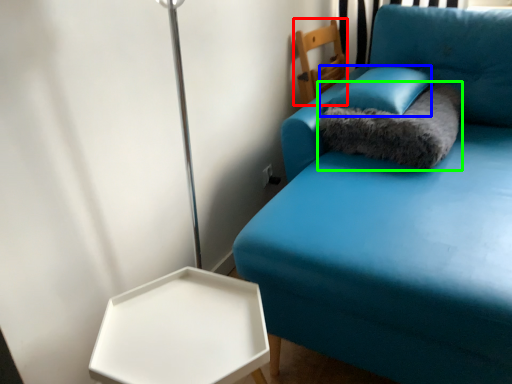
Question: Considering the real-world distances, which object is farthest from furniture (highlighted by a red box)? pillow (highlighted by a blue box) or cat bed (highlighted by a green box)?

Choices:
 (A) pillow
 (B) cat bed

Answer: (B)